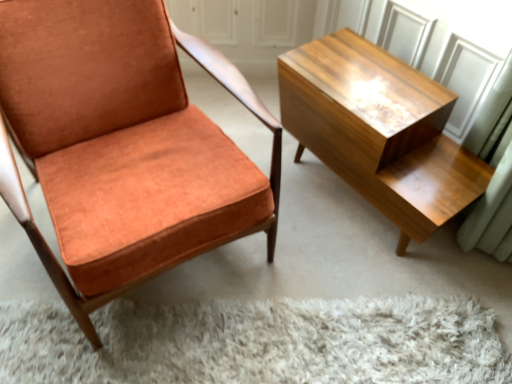
Question: From the image's perspective, is matte orange fabric chair at left above or below shiny wood table at right?

Choices:
 (A) below
 (B) above

Answer: (B)

Question: Choose the correct answer: Is matte orange fabric chair at left inside shiny wood table at right or outside it?

Choices:
 (A) outside
 (B) inside

Answer: (A)

Question: Considering the positions of point (65, 87) and point (403, 152), is point (65, 87) closer or farther from the camera than point (403, 152)?

Choices:
 (A) farther
 (B) closer

Answer: (B)

Question: From a real-world perspective, is shiny wood table at right above or below matte orange fabric chair at left?

Choices:
 (A) below
 (B) above

Answer: (A)

Question: Is point (326, 163) closer or farther from the camera than point (50, 86)?

Choices:
 (A) farther
 (B) closer

Answer: (A)

Question: Looking at their shapes, would you say shiny wood table at right is wider or thinner than matte orange fabric chair at left?

Choices:
 (A) thin
 (B) wide

Answer: (A)

Question: Considering the positions of shiny wood table at right and matte orange fabric chair at left in the image, is shiny wood table at right taller or shorter than matte orange fabric chair at left?

Choices:
 (A) tall
 (B) short

Answer: (B)